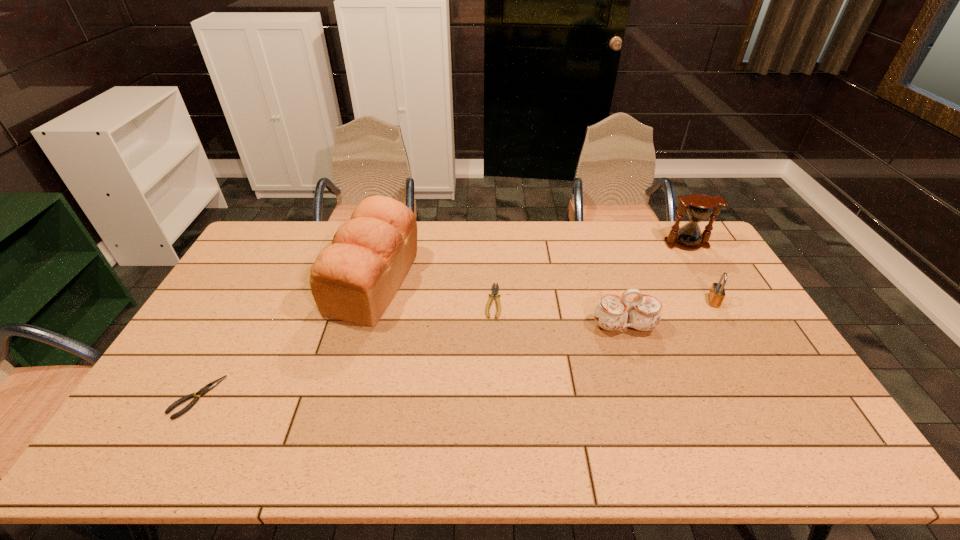
You are a GUI agent. You are given a task and a screenshot of the screen. Output one action in this format:
    pyautogui.click(x=<x>, y=<y>)
    Task: Click on the tallest object
    Image resolution: width=960 pixels, height=540 pixels.
    Given the screenshot: What is the action you would take?
    pyautogui.click(x=354, y=280)

At what (x,y) coordinates should I click in order to perform the action: click on the second object from left to right. Please return your answer as a coordinate pair (x, y). The image size is (960, 540). Looking at the image, I should click on (354, 280).

At what (x,y) coordinates should I click in order to perform the action: click on hourglass. Please return your answer as a coordinate pair (x, y). Looking at the image, I should click on (699, 207).

The image size is (960, 540). Identify the location of the fourth shortest object. (612, 313).

Identify the location of chinaware. The height and width of the screenshot is (540, 960). (612, 313).

This screenshot has width=960, height=540. Find the location of `padlock`. padlock is located at coordinates (716, 294).

The height and width of the screenshot is (540, 960). In order to click on the nearer pliers in this screenshot , I will do `click(210, 386)`.

You are a GUI agent. You are given a task and a screenshot of the screen. Output one action in this format:
    pyautogui.click(x=<x>, y=<y>)
    Task: Click on the leftmost object
    The width and height of the screenshot is (960, 540).
    Given the screenshot: What is the action you would take?
    pyautogui.click(x=210, y=386)

The height and width of the screenshot is (540, 960). I want to click on the third object from left to right, so click(x=494, y=291).

The width and height of the screenshot is (960, 540). I want to click on the right pliers, so click(494, 291).